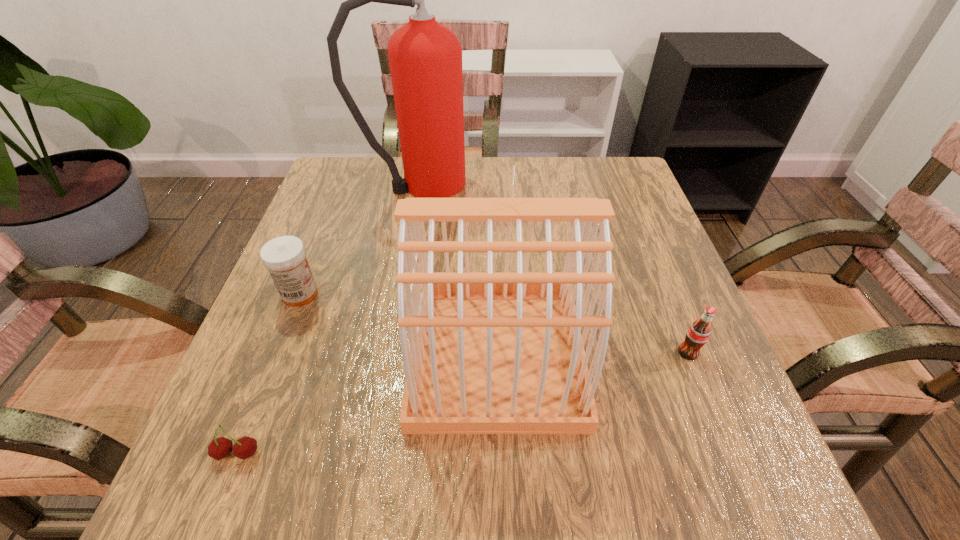
Identify the location of object that is at the far left corner. The height and width of the screenshot is (540, 960). (425, 57).

I want to click on object present at the near left corner, so click(245, 447).

The image size is (960, 540). I want to click on vacant space at the far edge of the desktop, so click(x=487, y=170).

Locate an element on the screen. This screenshot has height=540, width=960. vacant position at the near edge of the desktop is located at coordinates pyautogui.click(x=534, y=477).

I want to click on vacant region at the left edge of the desktop, so click(329, 304).

Locate an element on the screen. Image resolution: width=960 pixels, height=540 pixels. vacant space at the right edge of the desktop is located at coordinates (622, 291).

At what (x,y) coordinates should I click in order to perform the action: click on vacant space at the near right corner of the desktop. Please return your answer as a coordinate pair (x, y). Image resolution: width=960 pixels, height=540 pixels. Looking at the image, I should click on (774, 481).

This screenshot has width=960, height=540. Identify the location of free space between the nearest object and the farthest object. (328, 319).

Identify the location of free area in between the soda and the birdcage. The image size is (960, 540). (592, 354).

You are a GUI agent. You are given a task and a screenshot of the screen. Output one action in this format:
    pyautogui.click(x=<x>, y=<y>)
    Task: Click on the free space between the cherry and the fire extinguisher
    This screenshot has height=540, width=960.
    Given the screenshot: What is the action you would take?
    pyautogui.click(x=328, y=319)